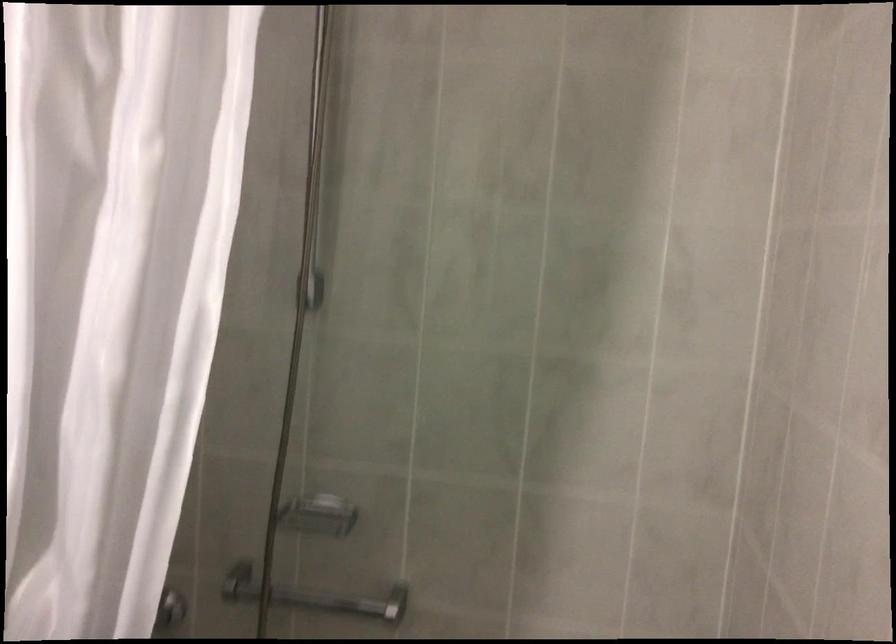
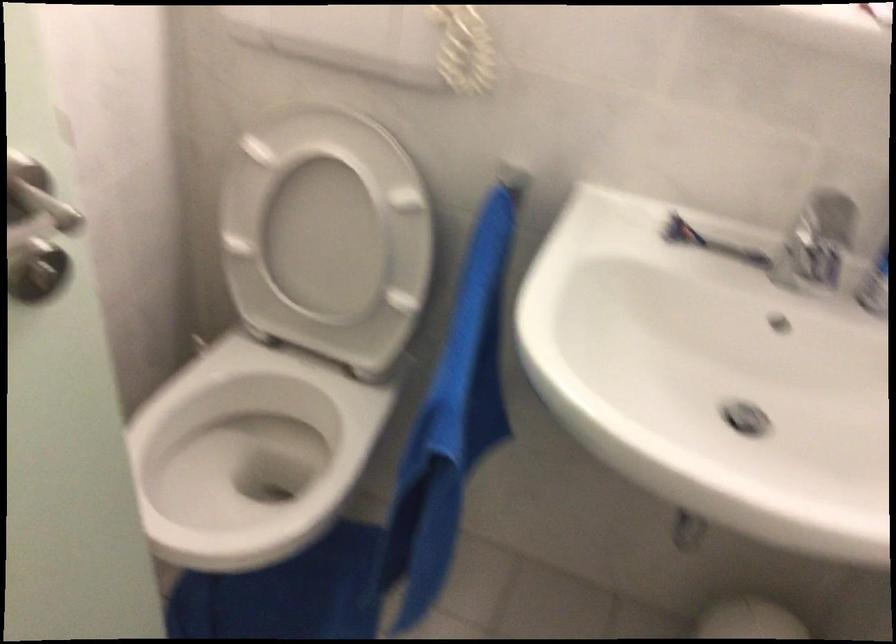
How did the camera likely rotate?

The rotation direction of the camera is left-down.